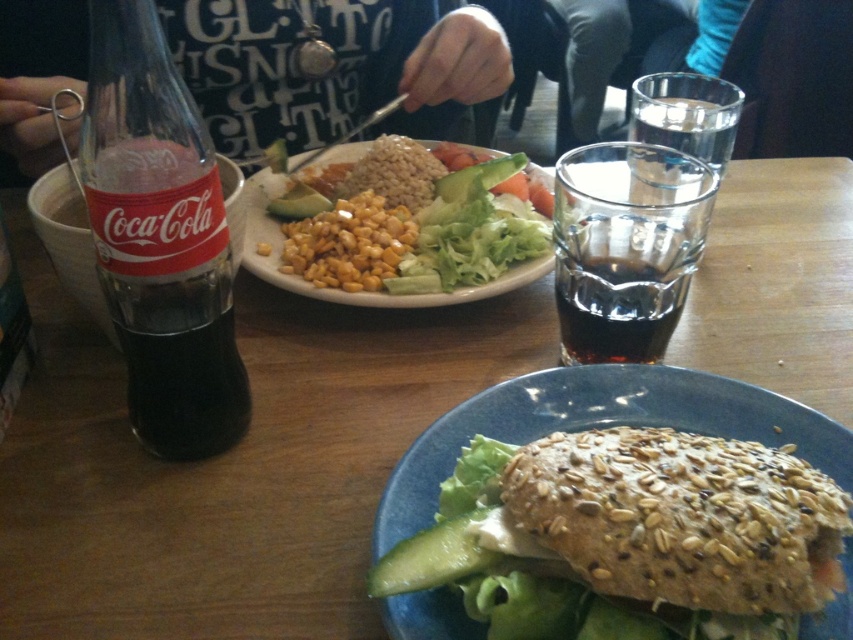
Question: Can you confirm if seeded bread at center is smaller than yellow corn at center?

Choices:
 (A) yes
 (B) no

Answer: (A)

Question: Which object appears closest to the camera in this image?

Choices:
 (A) yellow corn at center
 (B) dark glass cup at upper center
 (C) black glass coca-cola bottle at left
 (D) seeded bread at center

Answer: (D)

Question: Does black cotton shirt at upper center have a greater width compared to green smooth pickle at lower center?

Choices:
 (A) no
 (B) yes

Answer: (B)

Question: Is black glass coca-cola bottle at left further to camera compared to yellow corn at center?

Choices:
 (A) yes
 (B) no

Answer: (B)

Question: Based on their relative distances, which object is nearer to the dark glass cup at upper center?

Choices:
 (A) green smooth pickle at lower center
 (B) black cotton shirt at upper center
 (C) yellow corn at center
 (D) black glass coca-cola bottle at left

Answer: (C)

Question: Among these points, which one is nearest to the camera?

Choices:
 (A) (544, 227)
 (B) (144, 170)
 (C) (656, 250)

Answer: (B)